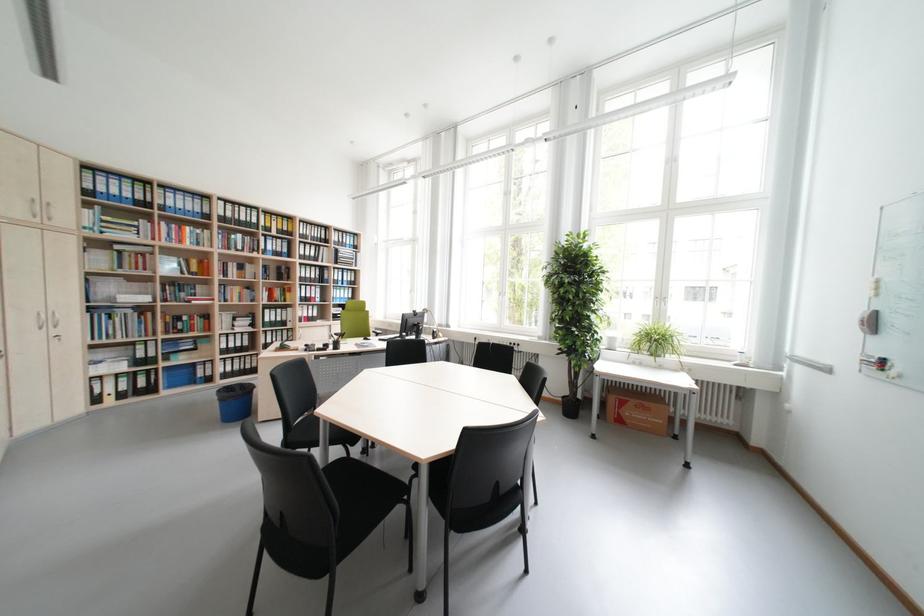
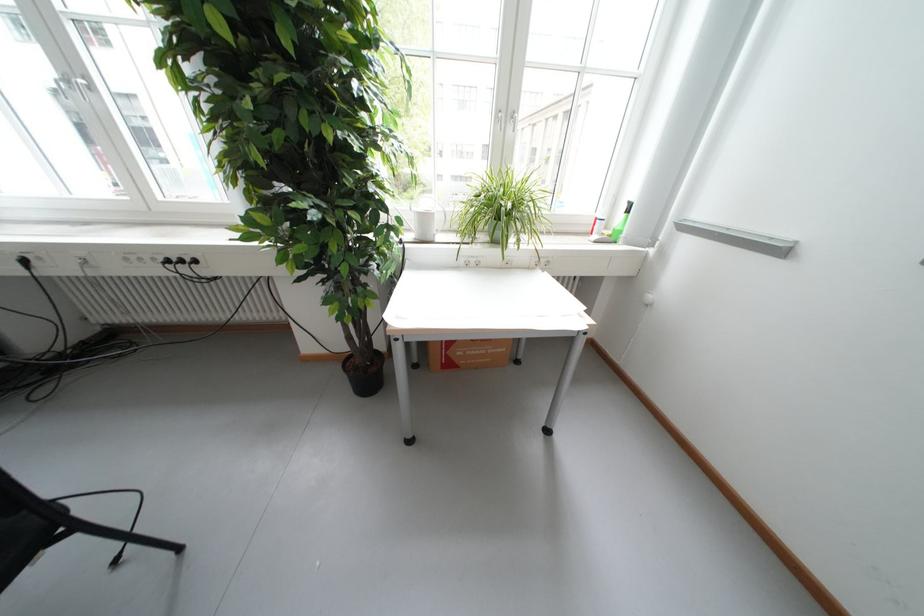
The point at (x=664, y=344) is marked in the first image. Where is the corresponding point in the second image?

(508, 217)